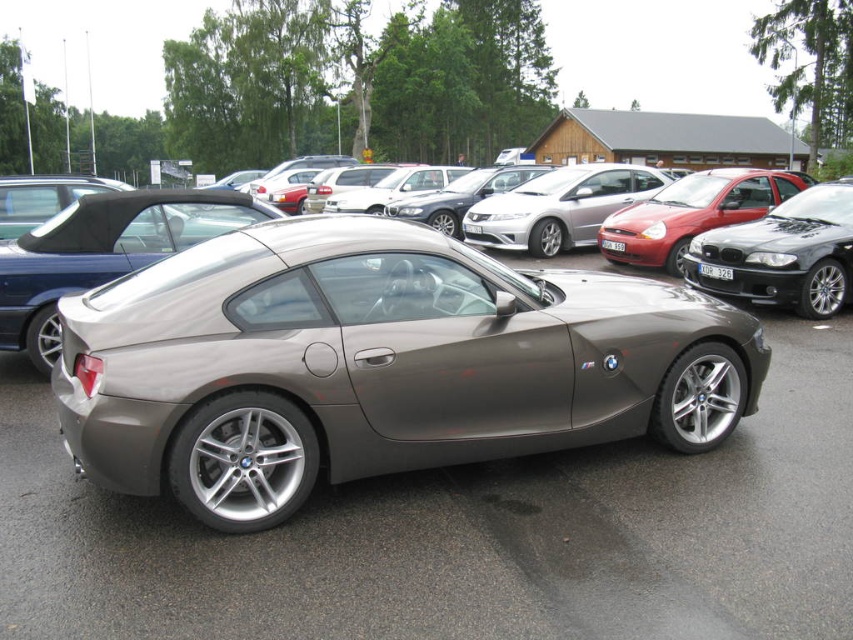
Question: Among these points, which one is farthest from the camera?

Choices:
 (A) (779, 406)
 (B) (750, 288)

Answer: (B)

Question: Is metallic gray car at center in front of satin black sedan at center?

Choices:
 (A) no
 (B) yes

Answer: (B)

Question: Is metallic gray car at center thinner than satin black sedan at center?

Choices:
 (A) no
 (B) yes

Answer: (A)

Question: Is metallic gray car at center to the left of satin black sedan at center from the viewer's perspective?

Choices:
 (A) yes
 (B) no

Answer: (A)

Question: Which object is closer to the camera taking this photo?

Choices:
 (A) metallic gray car at center
 (B) satin black sedan at center

Answer: (A)

Question: Which point is closer to the camera?

Choices:
 (A) metallic gray car at center
 (B) satin black sedan at center

Answer: (A)